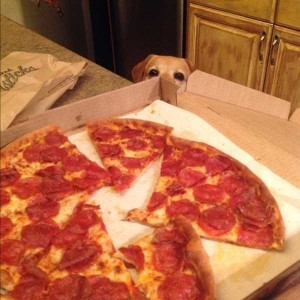
The height and width of the screenshot is (300, 300). What are the coordinates of `drawer` in the screenshot? It's located at (243, 8).